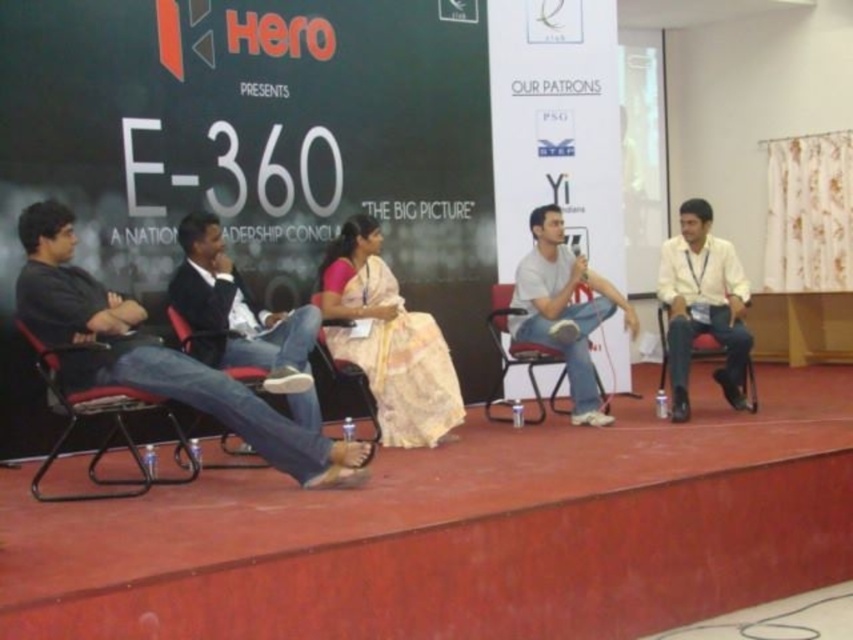
Is point (374, 272) closer to viewer compared to point (212, 467)?

No, it is behind (212, 467).

Between silk saree at center and matte black chair at center, which one appears on the left side from the viewer's perspective?

Positioned to the left is matte black chair at center.

The image size is (853, 640). Find the location of `silk saree at center`. silk saree at center is located at coordinates [x=387, y=340].

Between black cotton shirt at left and silk saree at center, which one has less height?

black cotton shirt at left

Is point (177, 353) farther from camera compared to point (399, 420)?

No, it is not.

You are a GUI agent. You are given a task and a screenshot of the screen. Output one action in this format:
    pyautogui.click(x=<x>, y=<y>)
    Task: Click on the black cotton shirt at left
    
    Given the screenshot: What is the action you would take?
    pyautogui.click(x=154, y=355)

Can you confirm if silk saree at center is shorter than metallic silver chair at right?

No, silk saree at center is not shorter than metallic silver chair at right.

Is silk saree at center positioned behind metallic silver chair at right?

No, it is in front of metallic silver chair at right.

This screenshot has height=640, width=853. I want to click on silk saree at center, so click(387, 340).